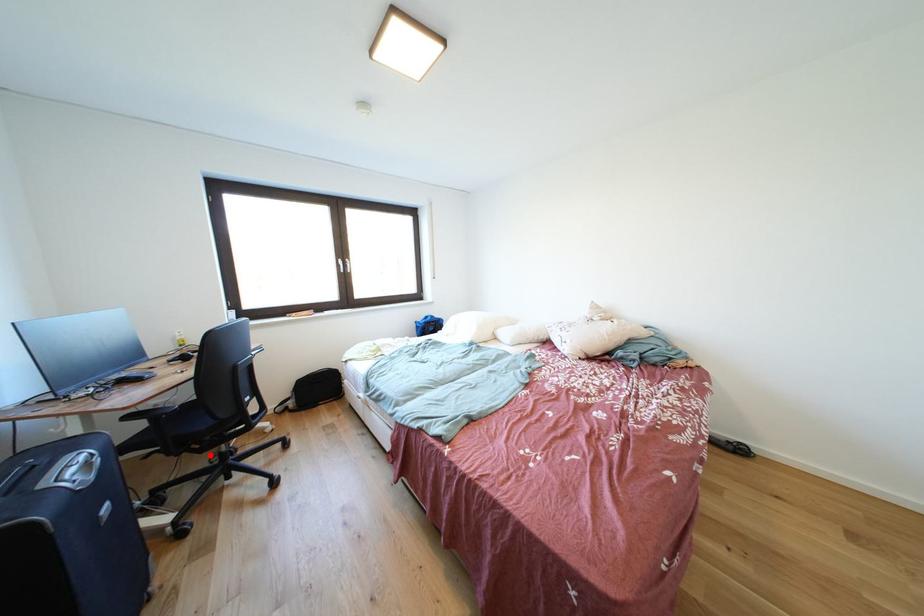
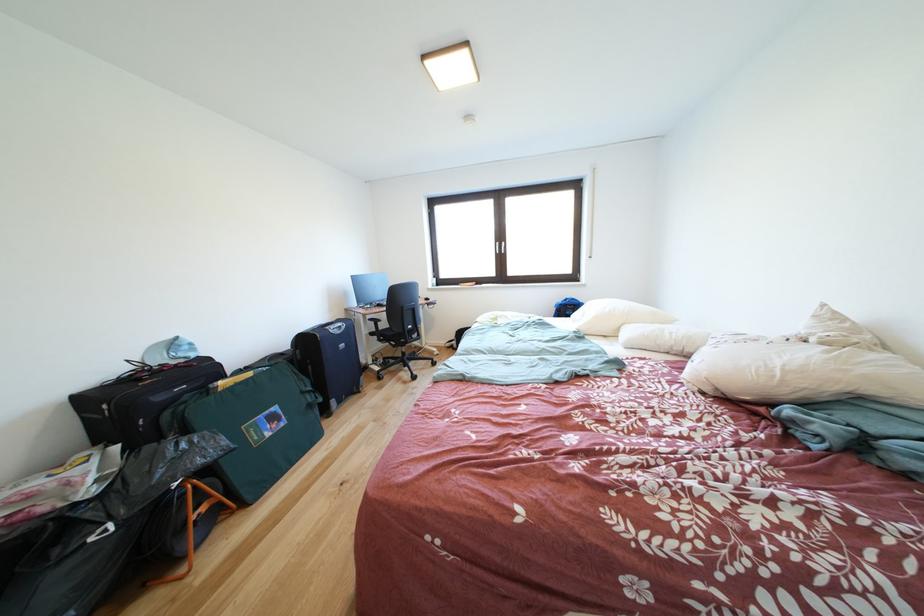
Where in the second image is the point corresponding to the highlighted location from the first image?

(403, 351)